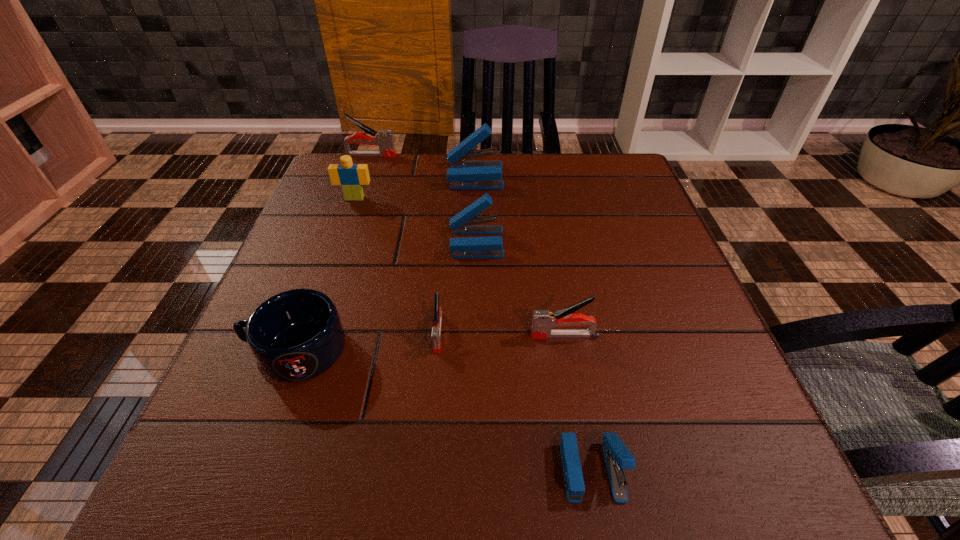
The image size is (960, 540). I want to click on vacant space located 0.250m on the handle side of the smallest gray stapler, so click(423, 507).

Locate an element on the screen. blank space located on the left of the rightmost blue stapler is located at coordinates (285, 469).

At what (x,y) coordinates should I click in order to perform the action: click on Lego that is at the far edge. Please return your answer as a coordinate pair (x, y). Looking at the image, I should click on (351, 177).

This screenshot has width=960, height=540. What are the coordinates of `object situated at the near edge` in the screenshot? It's located at (617, 456).

Locate an element on the screen. This screenshot has height=540, width=960. stapler that is at the left edge is located at coordinates (384, 139).

Find the location of a particular element. The width and height of the screenshot is (960, 540). Lego located at the left edge is located at coordinates (351, 177).

This screenshot has width=960, height=540. In order to click on mug present at the left edge in this screenshot , I will do `click(296, 335)`.

You are a GUI agent. You are given a task and a screenshot of the screen. Output one action in this format:
    pyautogui.click(x=<x>, y=<y>)
    Task: Click on the stapler positioned at the far left corner
    The image size is (960, 540).
    Given the screenshot: What is the action you would take?
    click(x=384, y=139)

Identify the location of Lego that is at the far left corner. The width and height of the screenshot is (960, 540). (351, 177).

This screenshot has height=540, width=960. I want to click on blank space at the far edge of the desktop, so click(430, 181).